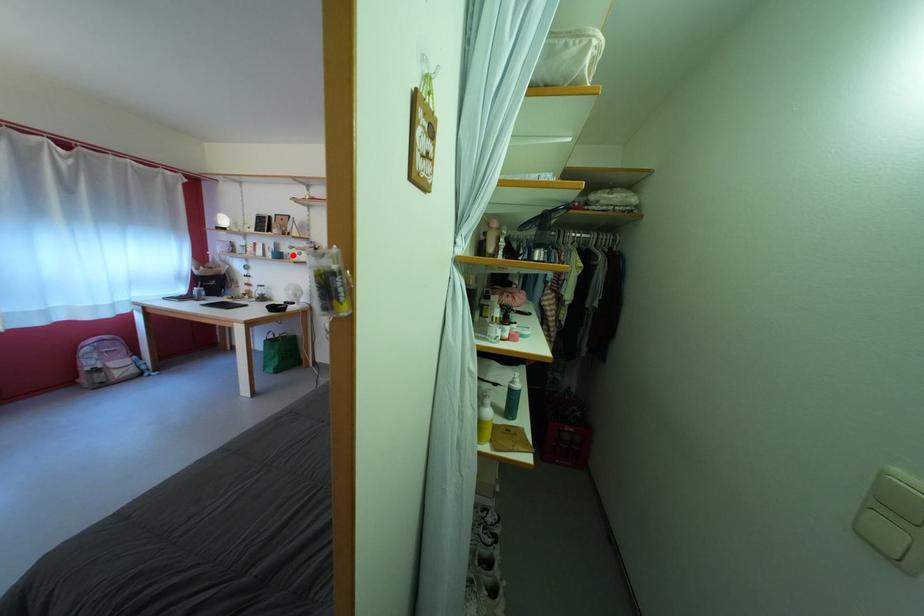
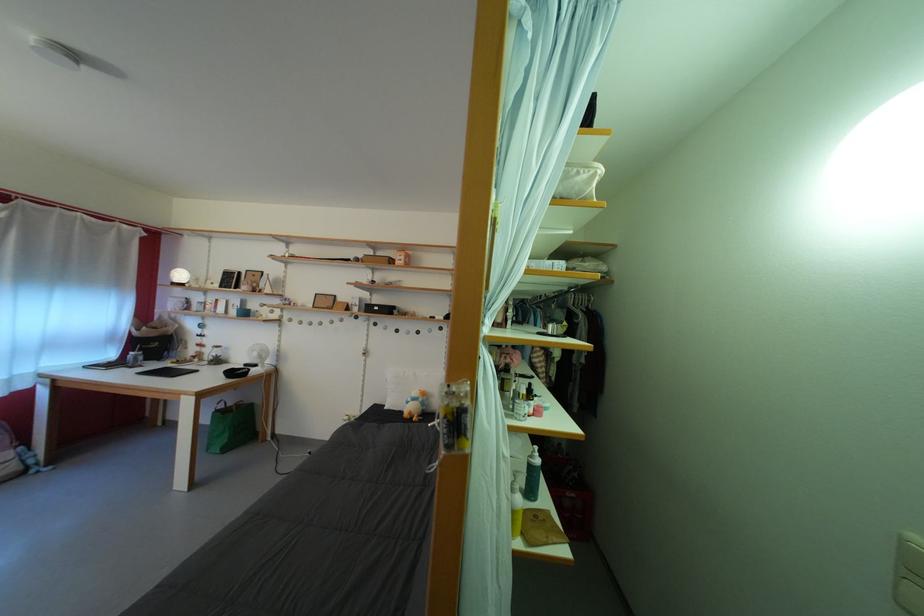
Find the pixel in the second image that matches the highlighted location in the first image.

(261, 312)